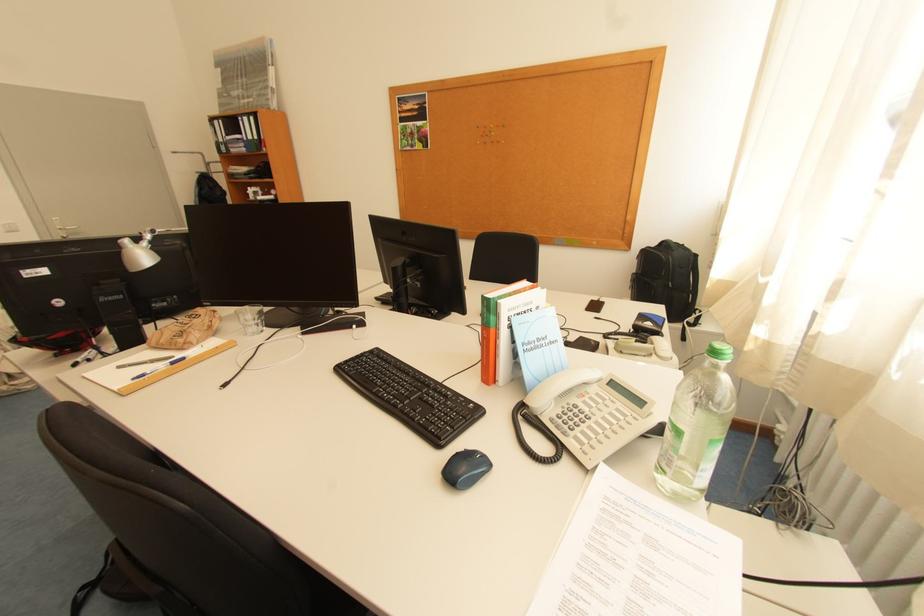
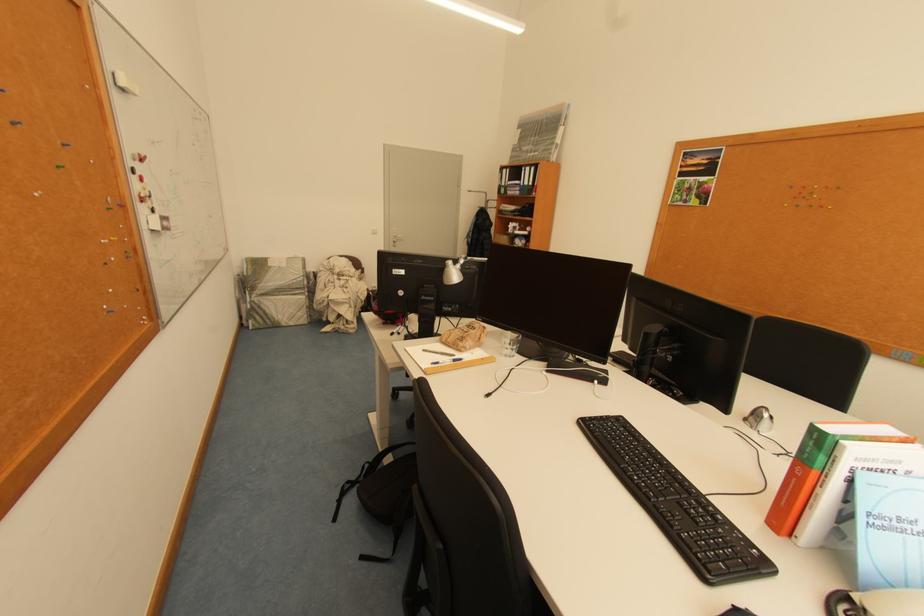
The point at (205, 315) is marked in the first image. Where is the corresponding point in the second image?

(481, 328)